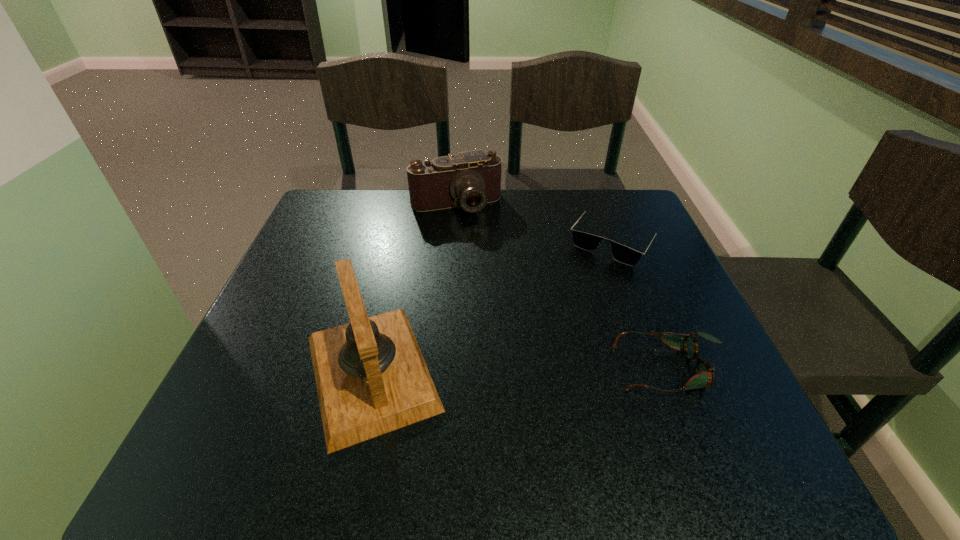
Find the location of `sunglasses present at the right edge`. sunglasses present at the right edge is located at coordinates 588,242.

Where is `object that is at the near left corner`? object that is at the near left corner is located at coordinates (371, 378).

Where is `object at the far right corner`? object at the far right corner is located at coordinates (588, 242).

Where is `object that is at the near right corner`? This screenshot has width=960, height=540. object that is at the near right corner is located at coordinates (704, 372).

You are a GUI agent. You are given a task and a screenshot of the screen. Output one action in this format:
    pyautogui.click(x=<x>, y=<y>)
    Task: Click on the vacant space at the far edge of the desktop
    This screenshot has height=540, width=960.
    Given the screenshot: What is the action you would take?
    pyautogui.click(x=394, y=201)

The image size is (960, 540). In order to click on vacant position at the left edge of the desktop in this screenshot , I will do `click(334, 244)`.

Where is `blank space at the right edge`? This screenshot has width=960, height=540. blank space at the right edge is located at coordinates (653, 285).

The height and width of the screenshot is (540, 960). What are the coordinates of `free space at the far left corner` in the screenshot? It's located at (368, 220).

This screenshot has height=540, width=960. I want to click on free space at the far right corner of the desktop, so click(609, 233).

Find the location of a particular element. The width and height of the screenshot is (960, 540). vacant region at the near right corner is located at coordinates (726, 393).